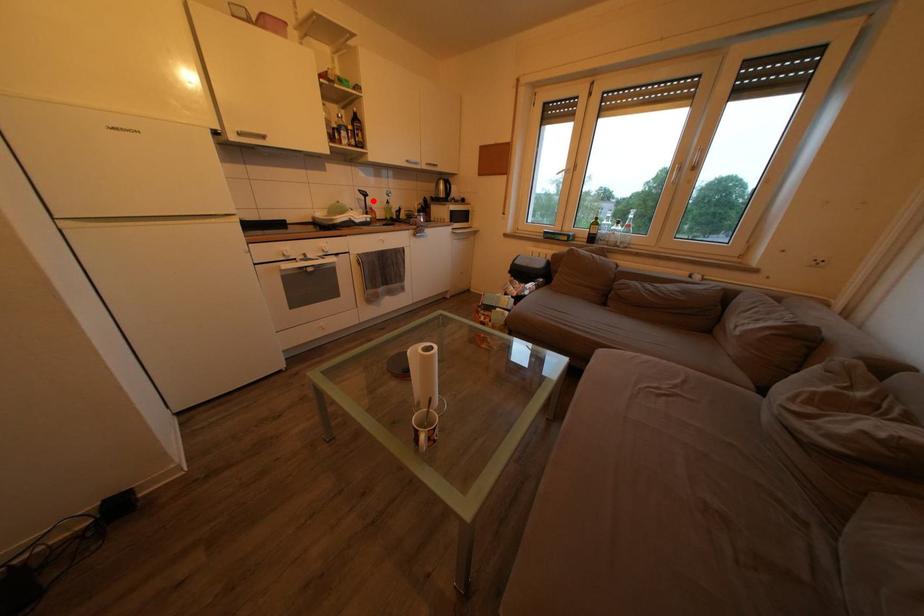
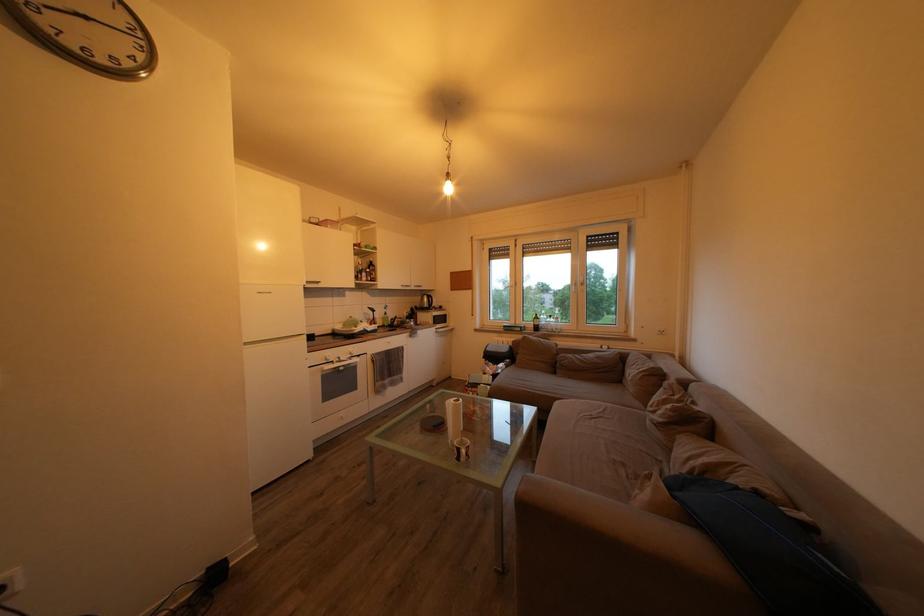
The point at the highlighted location is marked in the first image. Where is the corresponding point in the second image?

(381, 317)